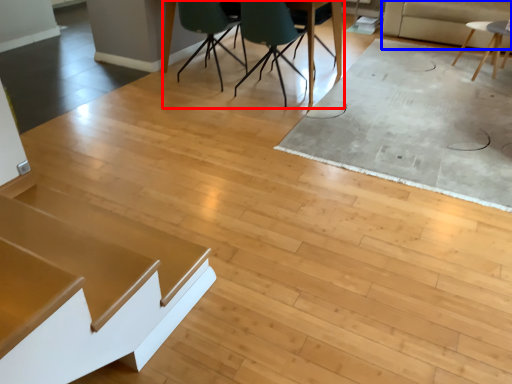
Question: Which point is closer to the camera, table (highlighted by a red box) or couch (highlighted by a blue box)?

Choices:
 (A) table
 (B) couch

Answer: (A)